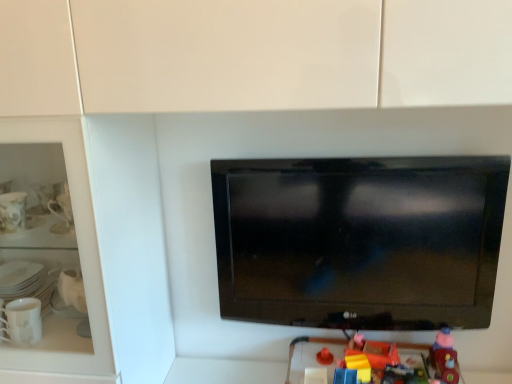
Question: Is rubberized plastic toy at lower center, which is counted as the 2th toy, starting from the right, wider than black glossy tv at center?

Choices:
 (A) yes
 (B) no

Answer: (B)

Question: From a real-world perspective, is rubberized plastic toy at lower center, which is the second toy in left-to-right order, on black glossy tv at center?

Choices:
 (A) no
 (B) yes

Answer: (A)

Question: Can you confirm if rubberized plastic toy at lower center, which is the second toy in left-to-right order, is thinner than black glossy tv at center?

Choices:
 (A) no
 (B) yes

Answer: (B)

Question: Can you confirm if rubberized plastic toy at lower center, which is counted as the 2th toy, starting from the right, is shorter than black glossy tv at center?

Choices:
 (A) no
 (B) yes

Answer: (B)

Question: Is rubberized plastic toy at lower center, which is counted as the 2th toy, starting from the right, at the right side of black glossy tv at center?

Choices:
 (A) no
 (B) yes

Answer: (B)

Question: From the image's perspective, is rubberized plastic toy at lower right, placed as the 1th toy when sorted from left to right, located above or below black glossy tv at center?

Choices:
 (A) above
 (B) below

Answer: (B)

Question: Looking at the image, does rubberized plastic toy at lower right, acting as the 3th toy starting from the right, seem bigger or smaller compared to black glossy tv at center?

Choices:
 (A) big
 (B) small

Answer: (B)

Question: From a real-world perspective, is rubberized plastic toy at lower right, acting as the 3th toy starting from the right, physically located above or below black glossy tv at center?

Choices:
 (A) below
 (B) above

Answer: (A)

Question: Visually, is rubberized plastic toy at lower right, acting as the 3th toy starting from the right, positioned to the left or to the right of black glossy tv at center?

Choices:
 (A) left
 (B) right

Answer: (B)

Question: Considering the positions of rubberized plastic toy at lower right, acting as the 3th toy starting from the right, and rubberized plastic toy at lower center, which is counted as the 2th toy, starting from the right, in the image, is rubberized plastic toy at lower right, acting as the 3th toy starting from the right, taller or shorter than rubberized plastic toy at lower center, which is counted as the 2th toy, starting from the right,?

Choices:
 (A) tall
 (B) short

Answer: (A)

Question: Looking at their shapes, would you say rubberized plastic toy at lower right, placed as the 1th toy when sorted from left to right, is wider or thinner than rubberized plastic toy at lower center, which is the second toy in left-to-right order?

Choices:
 (A) thin
 (B) wide

Answer: (B)

Question: Looking at the image, does rubberized plastic toy at lower right, acting as the 3th toy starting from the right, seem bigger or smaller compared to rubberized plastic toy at lower center, which is the second toy in left-to-right order?

Choices:
 (A) small
 (B) big

Answer: (B)

Question: Is rubberized plastic toy at lower right, placed as the 1th toy when sorted from left to right, inside or outside of rubberized plastic toy at lower center, which is the second toy in left-to-right order?

Choices:
 (A) outside
 (B) inside

Answer: (A)

Question: From the image's perspective, is matte plastic toy at lower right, the third toy in the left-to-right sequence, positioned above or below black glossy tv at center?

Choices:
 (A) below
 (B) above

Answer: (A)

Question: Considering the positions of matte plastic toy at lower right, which is counted as the first toy, starting from the right, and black glossy tv at center in the image, is matte plastic toy at lower right, which is counted as the first toy, starting from the right, taller or shorter than black glossy tv at center?

Choices:
 (A) tall
 (B) short

Answer: (B)